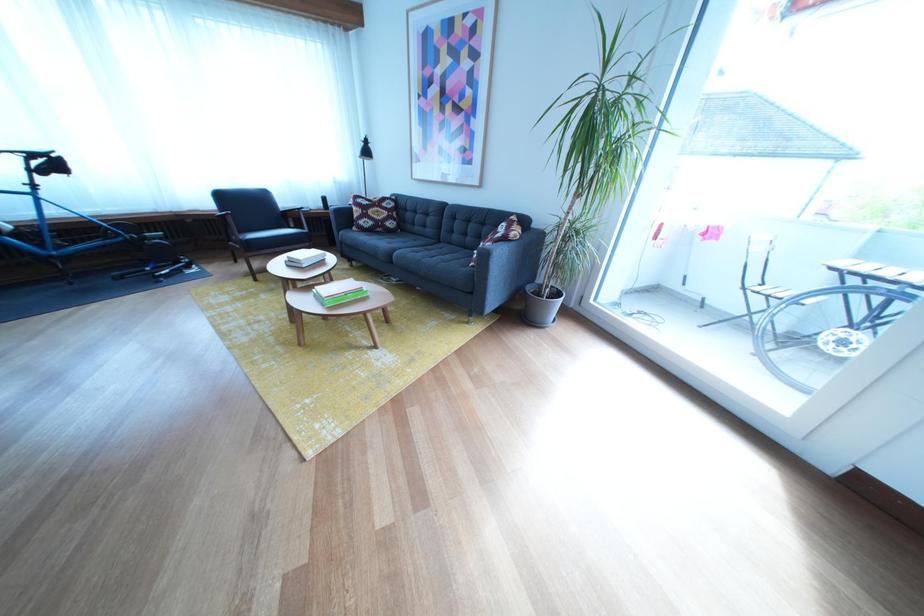
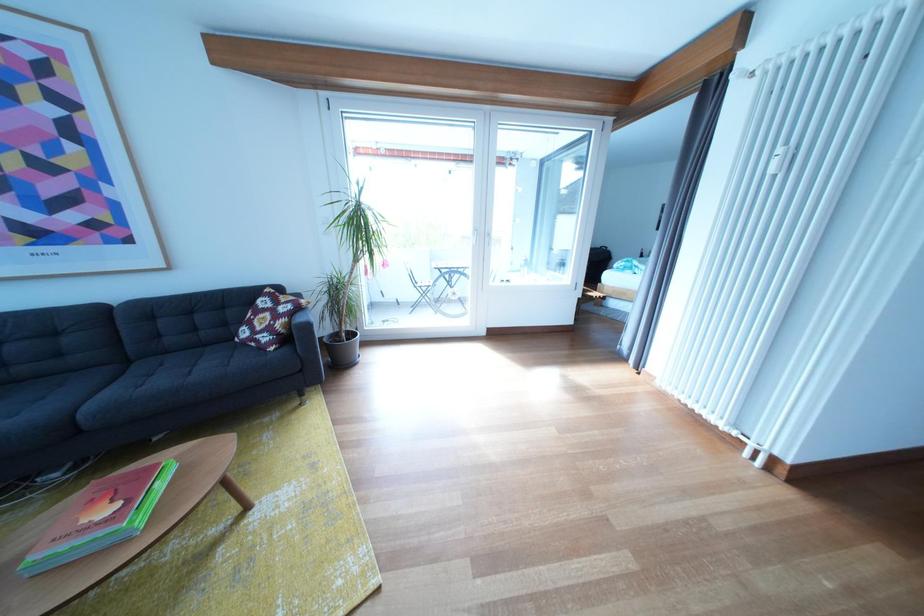
Where in the second image is the point corresponding to point (453, 248) from the first image?

(141, 368)